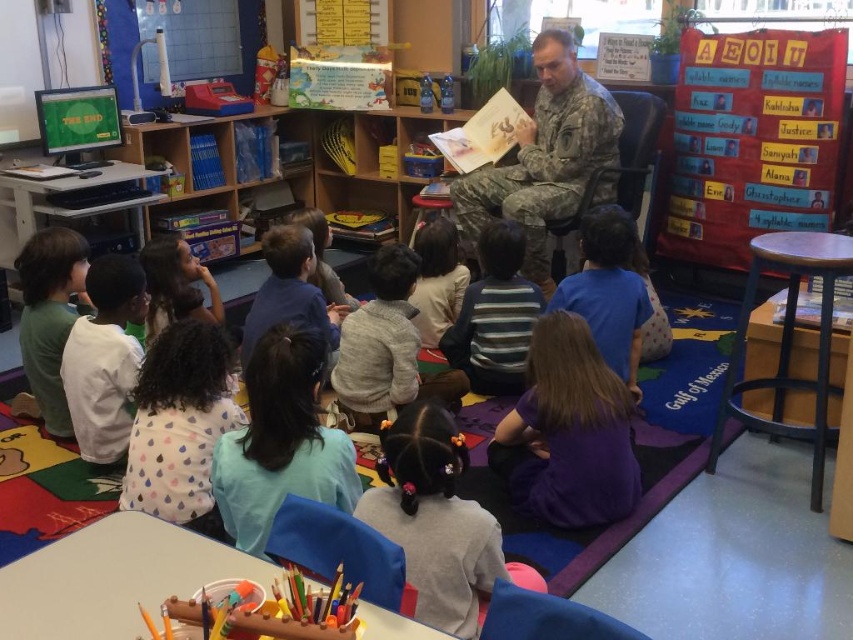
Question: Which point appears farthest from the camera in this image?

Choices:
 (A) (55, 424)
 (B) (440, 611)

Answer: (A)

Question: Observing the image, what is the correct spatial positioning of striped sweater at center in reference to light brown sweater at center?

Choices:
 (A) below
 (B) above

Answer: (A)

Question: Among these points, which one is farthest from the camera?

Choices:
 (A) (480, 188)
 (B) (772, 228)
 (C) (227, 436)

Answer: (A)

Question: Based on their relative distances, which object is farther from the green matte shirt at left?

Choices:
 (A) white cotton shirt at left
 (B) white dotted shirt at lower left
 (C) purple fabric at lower center
 (D) striped sweater at center

Answer: (C)

Question: Can you confirm if light blue shirt at lower center is positioned above light brown sweater at center?

Choices:
 (A) yes
 (B) no

Answer: (B)

Question: Is white dotted shirt at lower left above purple fabric at lower center?

Choices:
 (A) no
 (B) yes

Answer: (A)